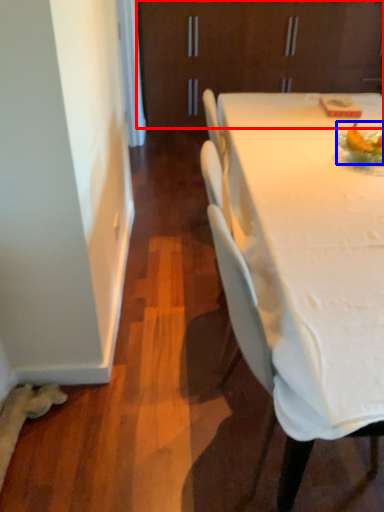
Question: Which of the following is the farthest to the observer, cabinetry (highlighted by a red box) or food (highlighted by a blue box)?

Choices:
 (A) cabinetry
 (B) food

Answer: (A)